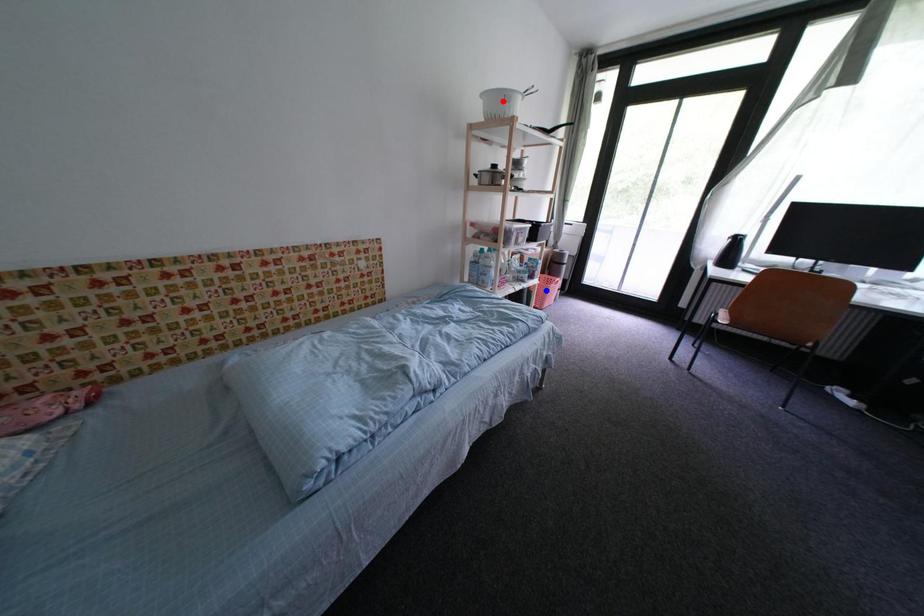
Question: Two points are marked on the image. Which point is closer to the camera?

Choices:
 (A) Blue point is closer.
 (B) Red point is closer.

Answer: (B)